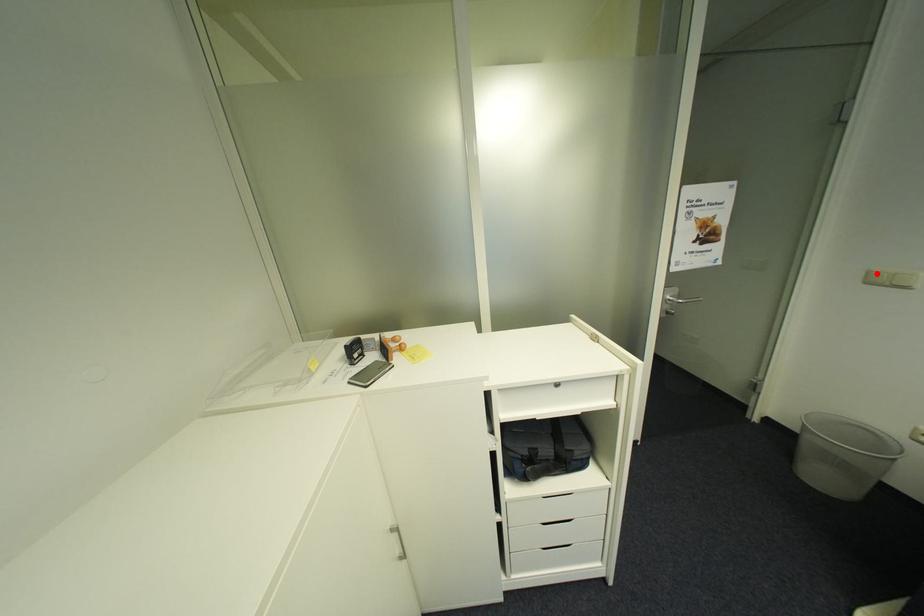
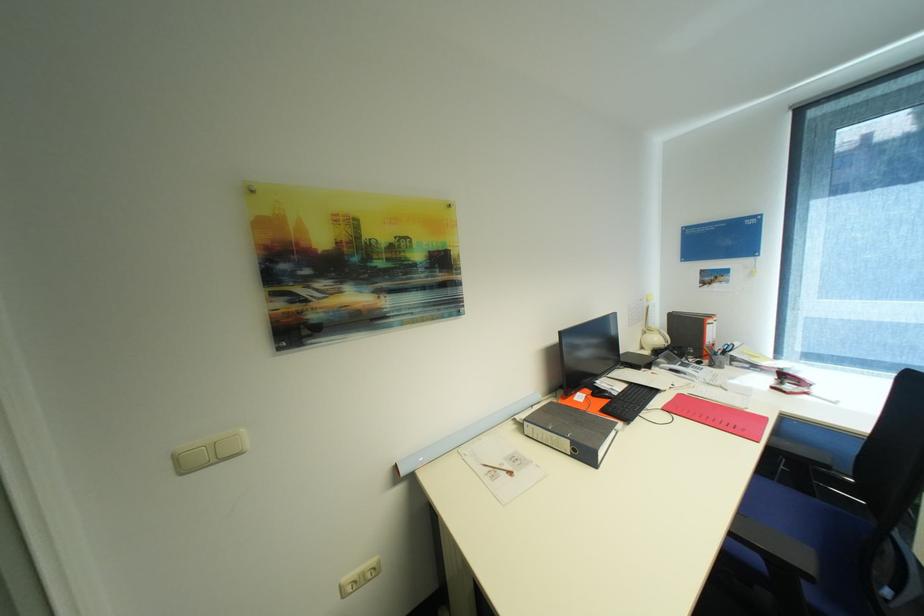
Locate, in the second image, the point that corresponds to the highlighted location in the first image.

(185, 458)